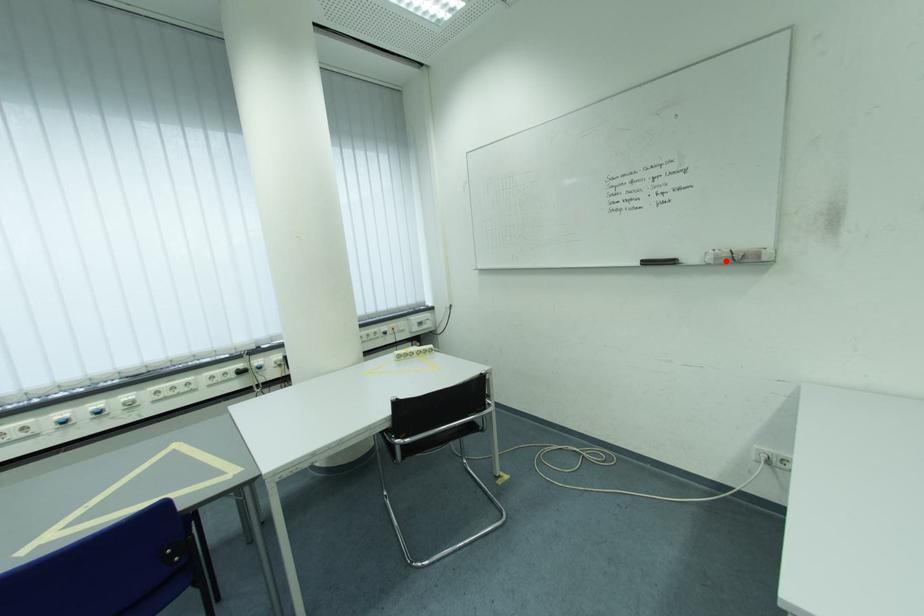
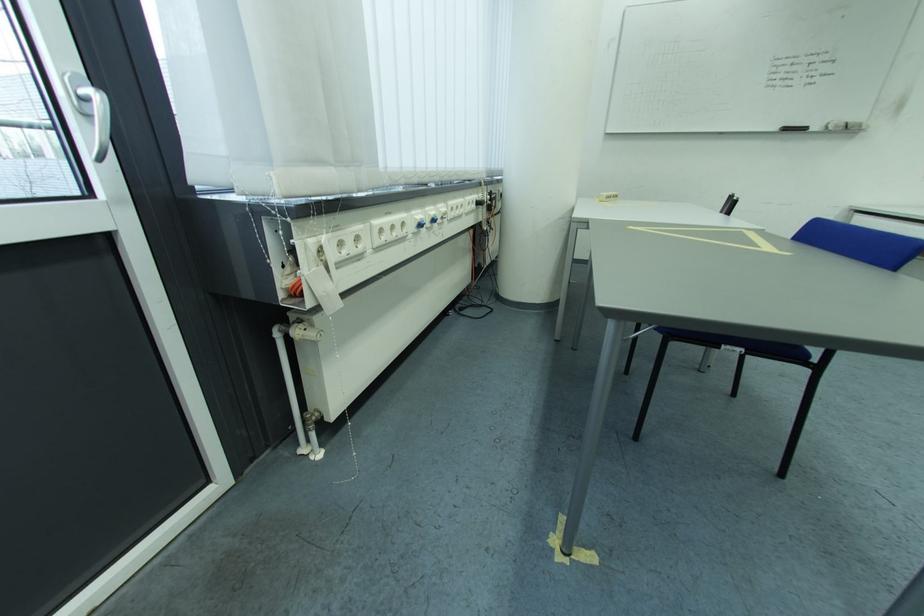
Locate, in the second image, the point that corresponds to the highlighted location in the first image.

(845, 129)